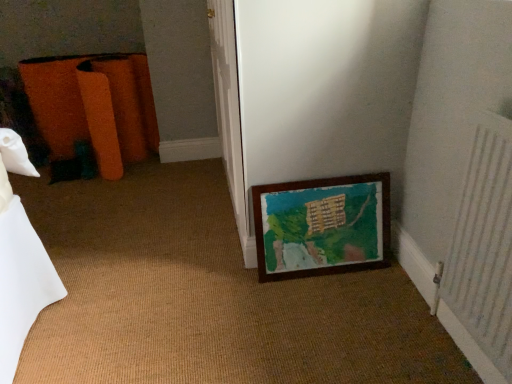
This screenshot has height=384, width=512. I want to click on vacant space to the left of white textured radiator at right, so click(x=387, y=349).